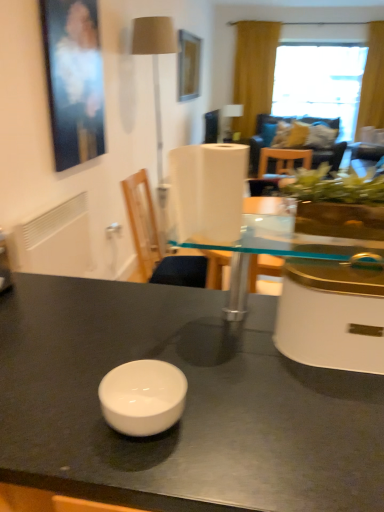
Question: Is transparent glass window at upper right wider or thinner than white glossy bowl at center?

Choices:
 (A) thin
 (B) wide

Answer: (B)

Question: Is transparent glass window at upper right in front of or behind white glossy bowl at center in the image?

Choices:
 (A) behind
 (B) front

Answer: (A)

Question: Considering the real-world distances, which object is farthest from the white glossy bowl at center?

Choices:
 (A) yellow fabric curtain at upper right
 (B) matte black picture frame at upper left, placed as the second picture frame when sorted from right to left
 (C) white matte radiator at left
 (D) wooden picture frame at upper center, the second picture frame in the left-to-right sequence
 (E) transparent glass table at center

Answer: (A)

Question: Considering the real-world distances, which object is closest to the wooden picture frame at upper center, positioned as the first picture frame in back-to-front order?

Choices:
 (A) beige fabric lampshade at upper left
 (B) transparent glass window at upper right
 (C) white plastic chair at center
 (D) transparent glass table at center
 (E) white glossy bowl at center

Answer: (A)